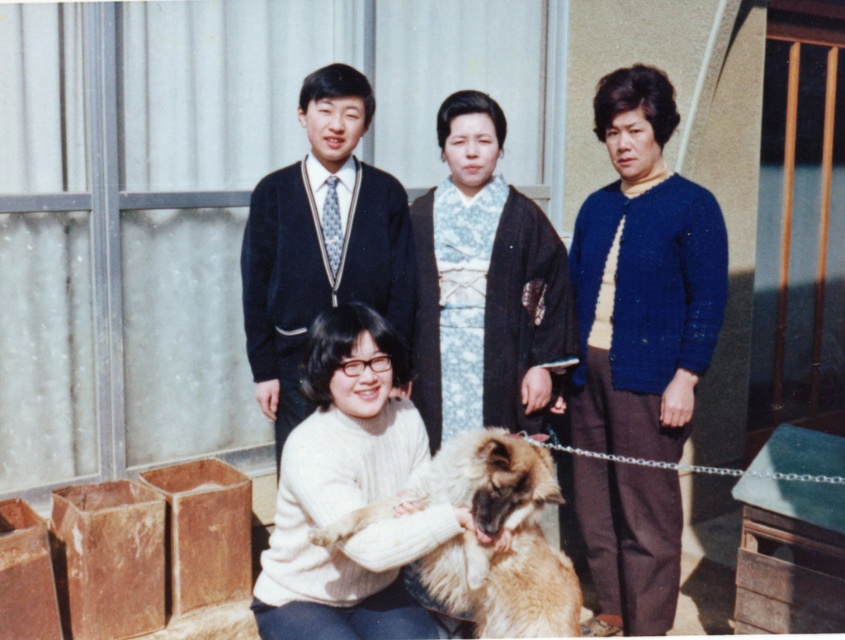
Question: Is blue knitted cardigan at right below dark blue sweater at center?

Choices:
 (A) yes
 (B) no

Answer: (A)

Question: Which point is closer to the camera?

Choices:
 (A) (464, 138)
 (B) (448, 499)

Answer: (B)

Question: Which point is farther from the camera taking this photo?

Choices:
 (A) (493, 188)
 (B) (598, 285)
 (C) (570, 593)

Answer: (A)

Question: Is the position of white sweater at center less distant than that of white wool sweater at center?

Choices:
 (A) yes
 (B) no

Answer: (B)

Question: Can you confirm if white sweater at center is thinner than fuzzy brown dog at center?

Choices:
 (A) yes
 (B) no

Answer: (B)

Question: Which of these objects is positioned closest to the dark blue sweater at center?

Choices:
 (A) blue kimono at center
 (B) white sweater at center
 (C) fuzzy brown dog at center

Answer: (A)